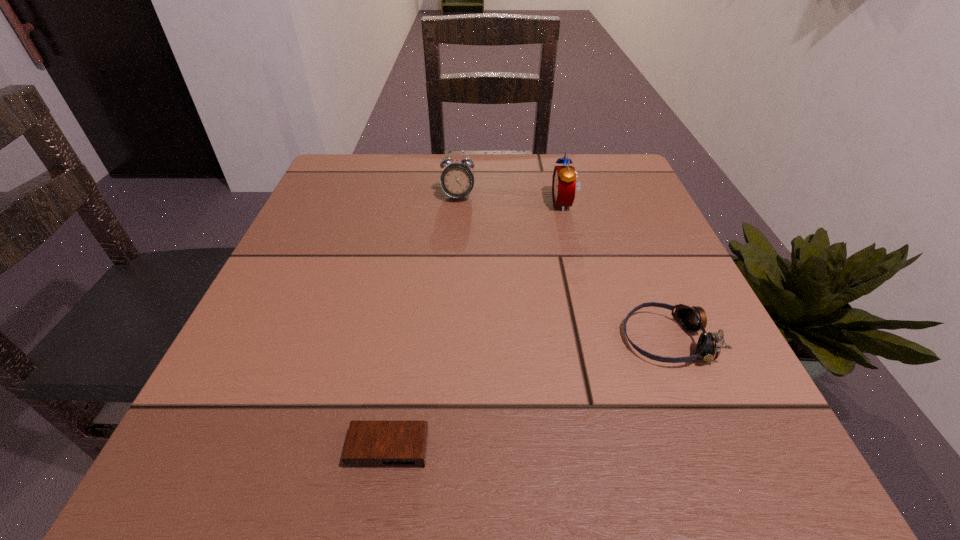
The height and width of the screenshot is (540, 960). I want to click on empty location between the shortest alarm clock and the third shortest object, so click(423, 322).

Find the location of a particular element. The image size is (960, 540). vacant point located between the second tallest object and the third object from left to right is located at coordinates (511, 200).

Select which object appears as the third closest to the rightmost alarm clock. Please provide its 2D coordinates. Your answer should be formatted as a tuple, i.e. [(x, y)], where the tuple contains the x and y coordinates of a point satisfying the conditions above.

[(369, 444)]

The height and width of the screenshot is (540, 960). In order to click on object that stands as the closest to the rightmost alarm clock in this screenshot , I will do `click(457, 180)`.

Where is `alarm clock object that ranks as the second closest to the nearest alarm clock`? alarm clock object that ranks as the second closest to the nearest alarm clock is located at coordinates [x=564, y=184].

This screenshot has width=960, height=540. I want to click on the closest alarm clock relative to the third object from left to right, so tap(457, 180).

The height and width of the screenshot is (540, 960). I want to click on free space in the image that satisfies the following two spatial constraints: 1. on the front-facing side of the rightmost alarm clock; 2. on the front face of the shortest alarm clock, so click(x=628, y=449).

I want to click on vacant area in the image that satisfies the following two spatial constraints: 1. on the front-facing side of the tallest alarm clock; 2. on the front face of the shortest object, so click(x=628, y=449).

Find the location of a particular element. Image resolution: width=960 pixels, height=540 pixels. free spot that satisfies the following two spatial constraints: 1. through the lenses of the goggles; 2. on the front face of the shortest alarm clock is located at coordinates (711, 449).

At what (x,y) coordinates should I click in order to perform the action: click on free spot that satisfies the following two spatial constraints: 1. through the lenses of the rightmost object; 2. on the front face of the nearest alarm clock. Please return your answer as a coordinate pair (x, y). Looking at the image, I should click on (711, 449).